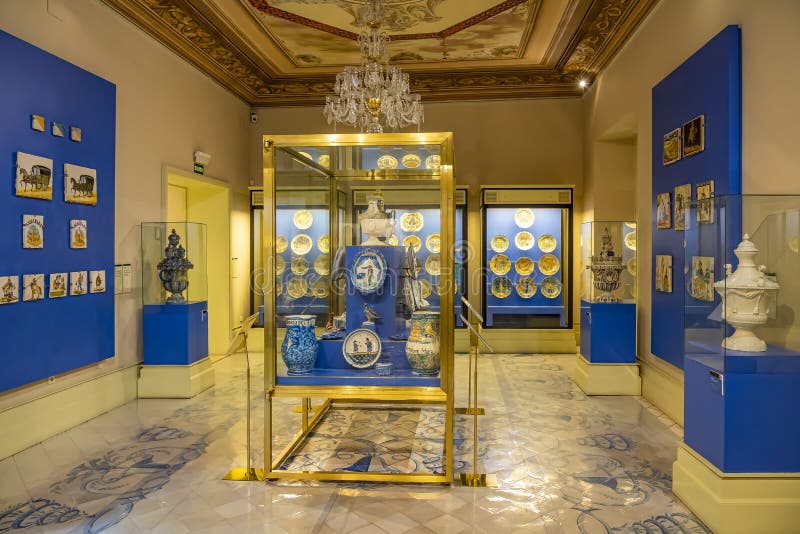
This screenshot has height=534, width=800. Find the location of `doorway`. doorway is located at coordinates 176,192, 622,179.